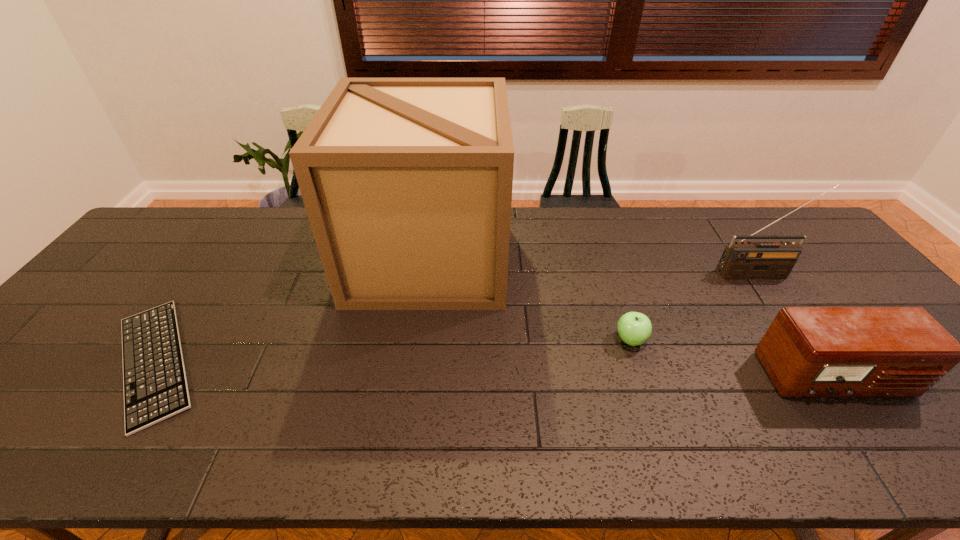
In the image, there is a desktop. Identify the location of vacant space at the far edge. (688, 213).

The width and height of the screenshot is (960, 540). Identify the location of vacant area at the near edge of the desktop. (468, 431).

This screenshot has height=540, width=960. In the image, there is a desktop. Find the location of `vacant space at the right edge`. vacant space at the right edge is located at coordinates (822, 302).

Identify the location of free space at the far left corner. (200, 210).

You are a GUI agent. You are given a task and a screenshot of the screen. Output one action in this format:
    pyautogui.click(x=<x>, y=<y>)
    Task: Click on the free space at the far right corner of the desktop
    The height and width of the screenshot is (540, 960).
    Given the screenshot: What is the action you would take?
    pos(796,222)

Locate an element on the screen. Image resolution: width=960 pixels, height=540 pixels. free point between the tallest object and the second tallest object is located at coordinates (592, 265).

Where is `empty location between the farther radio receiver and the leftmost object`? This screenshot has height=540, width=960. empty location between the farther radio receiver and the leftmost object is located at coordinates (455, 318).

At what (x,y) coordinates should I click in order to perform the action: click on vacant space that is in between the third object from right to left and the shortest object. Please return your answer as a coordinate pair (x, y). Looking at the image, I should click on (393, 350).

This screenshot has width=960, height=540. Identify the location of vacant point located between the taller radio receiver and the box. (592, 265).

This screenshot has height=540, width=960. In order to click on empty space between the apple and the shortest object in this screenshot , I will do `click(393, 350)`.